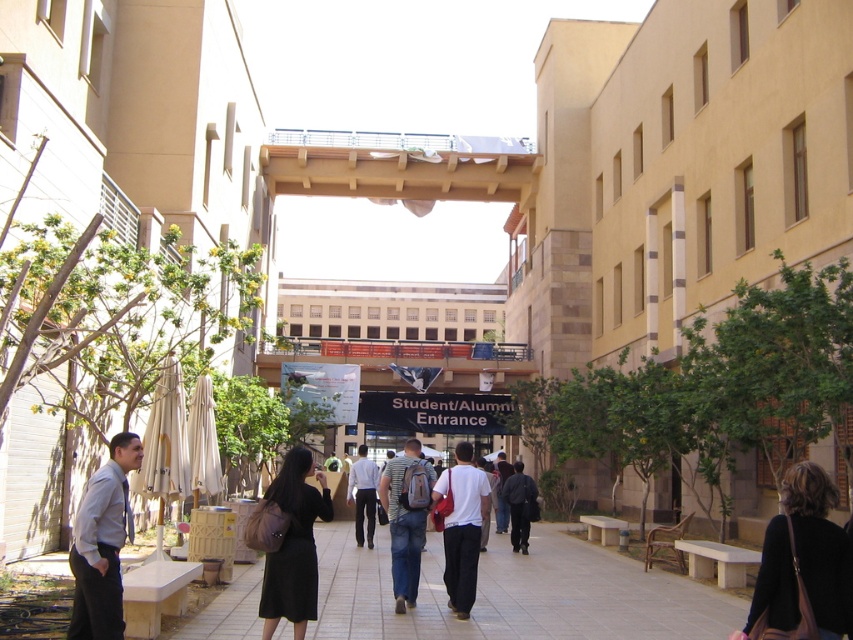
Who is shorter, light beige paving stone at center or light blue shirt at left?

light blue shirt at left is shorter.

You are a GUI agent. You are given a task and a screenshot of the screen. Output one action in this format:
    pyautogui.click(x=<x>, y=<y>)
    Task: Click on the light beige paving stone at center
    
    Given the screenshot: What is the action you would take?
    pyautogui.click(x=517, y=595)

Locate an element on the screen. The image size is (853, 640). light beige paving stone at center is located at coordinates (517, 595).

What do you see at coordinates (405, 518) in the screenshot? Image resolution: width=853 pixels, height=640 pixels. I see `striped cotton shirt at center` at bounding box center [405, 518].

Does striped cotton shirt at center have a lesser width compared to white smooth shirt at center?

Yes.

Is point (425, 499) positioned in front of point (357, 474)?

Yes, it is in front of point (357, 474).

Identify the location of striped cotton shirt at center. (405, 518).

Consider the image. Between light blue shirt at left and black matte dress at center, which one has more height?

Standing taller between the two is black matte dress at center.

Who is higher up, light blue shirt at left or black matte dress at center?

light blue shirt at left is higher up.

Does point (80, 508) lie in front of point (280, 582)?

Yes, it is in front of point (280, 582).

This screenshot has width=853, height=640. I want to click on light blue shirt at left, so click(x=102, y=544).